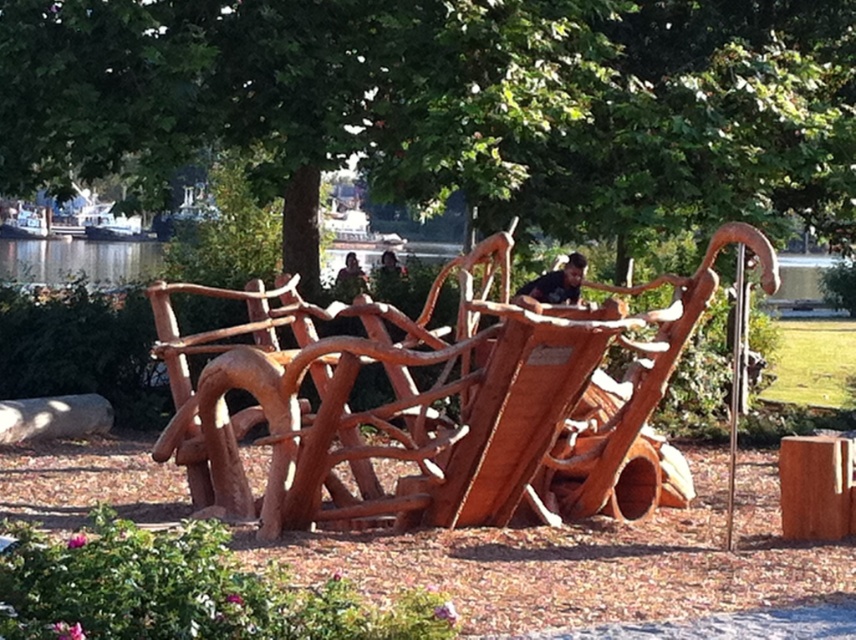
Question: Which object is positioned farthest from the natural wood sleigh at center?

Choices:
 (A) brown wooden bench at center
 (B) matte brown wooden bench at center
 (C) brown wooden post at center
 (D) natural wood tree at center

Answer: (B)

Question: Can you confirm if natural wood tree at center is smaller than brown wooden bench at center?

Choices:
 (A) no
 (B) yes

Answer: (B)

Question: Which object is closer to the camera taking this photo?

Choices:
 (A) brown wooden bench at center
 (B) brown wooden post at center

Answer: (B)

Question: Which object appears farthest from the camera in this image?

Choices:
 (A) brown wooden bench at center
 (B) brown wooden post at center

Answer: (A)

Question: From the image, what is the correct spatial relationship of natural wood sleigh at center in relation to matte brown wooden bench at center?

Choices:
 (A) above
 (B) below

Answer: (B)

Question: Is natural wood sleigh at center to the left of brown wooden bench at center from the viewer's perspective?

Choices:
 (A) yes
 (B) no

Answer: (A)